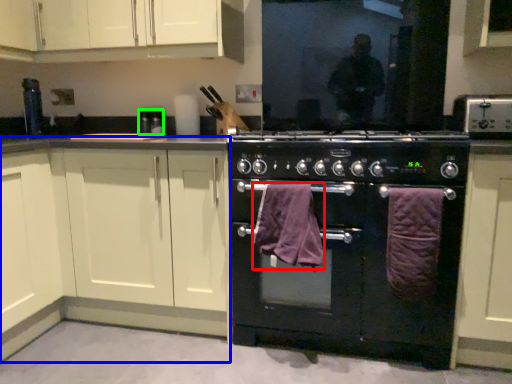
Question: Which object is the farthest from bath towel (highlighted by a red box)? Choose among these: cabinetry (highlighted by a blue box) or appliance (highlighted by a green box).

Choices:
 (A) cabinetry
 (B) appliance

Answer: (B)